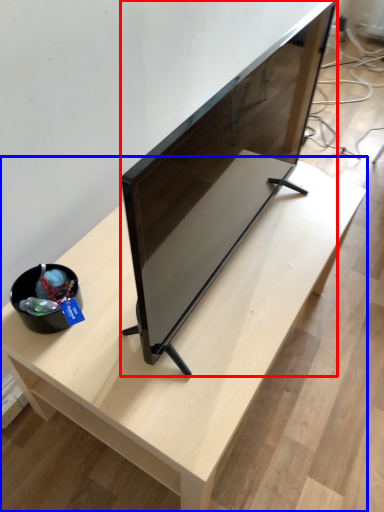
Question: Which point is closer to the camera, television (highlighted by a red box) or table (highlighted by a blue box)?

Choices:
 (A) television
 (B) table

Answer: (A)